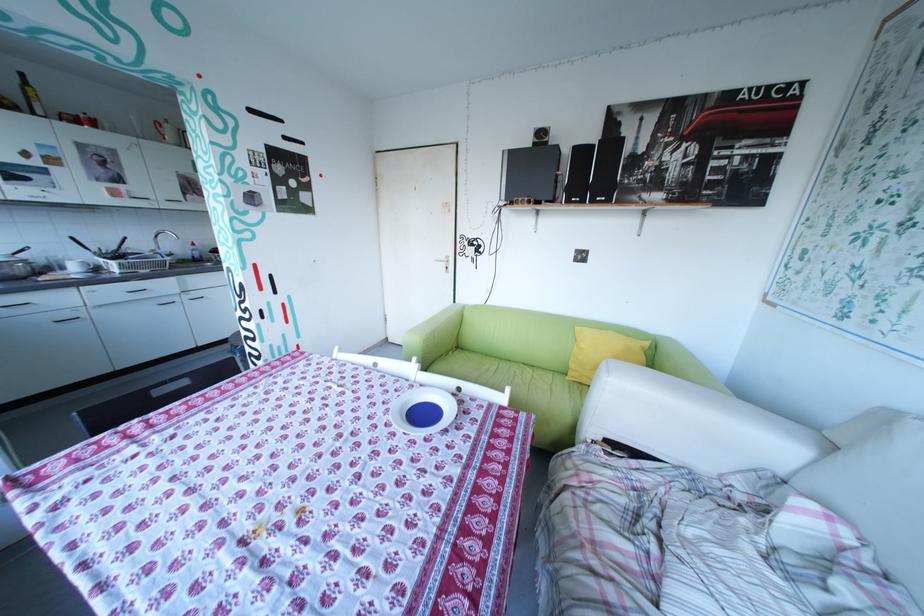
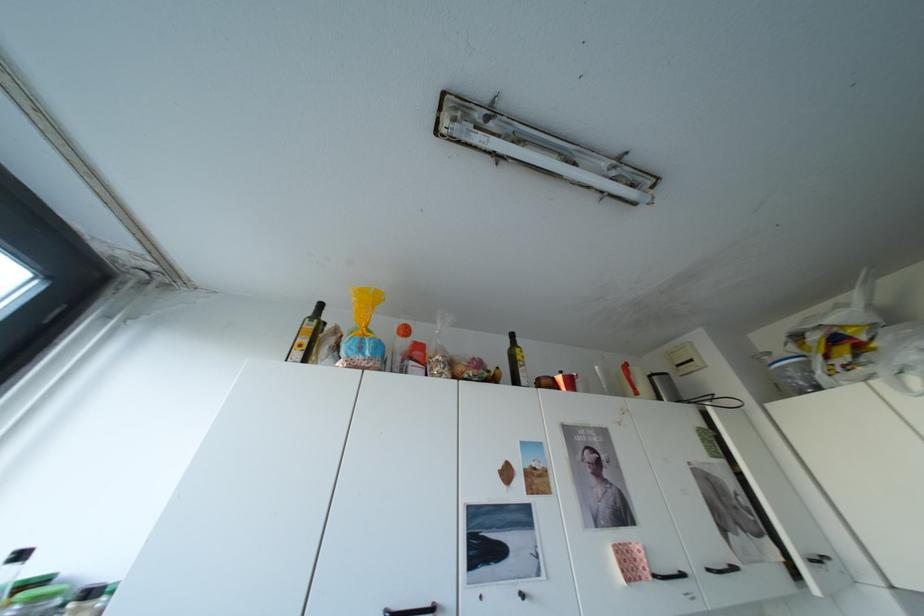
Find the pixel in the second image that matches point (128, 193) in the first image.

(642, 568)